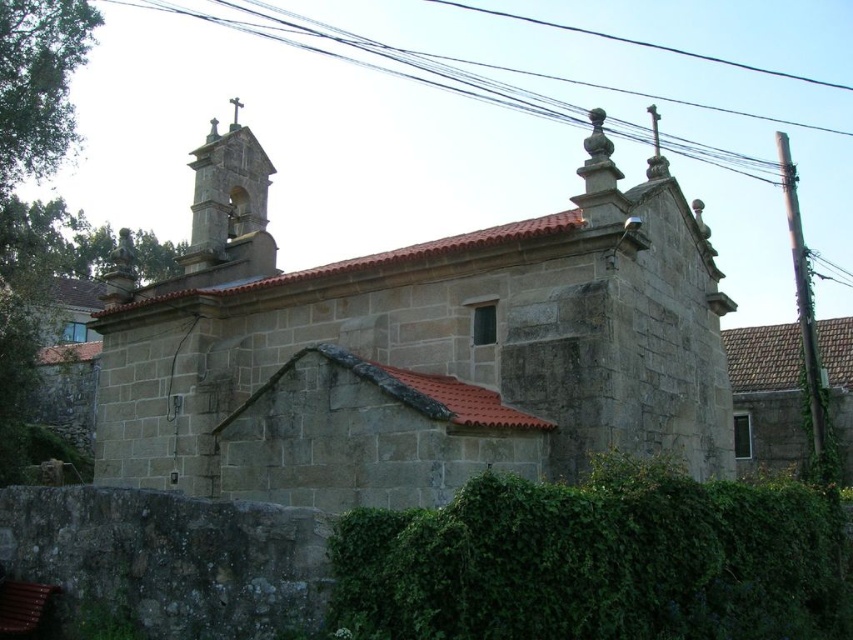
Does stone church at center have a larger size compared to green leafy hedge at lower center?

Correct, stone church at center is larger in size than green leafy hedge at lower center.

Between point (160, 288) and point (541, 586), which one is positioned behind?

The point (160, 288) is more distant.

Find the location of a particular element. stone church at center is located at coordinates (415, 348).